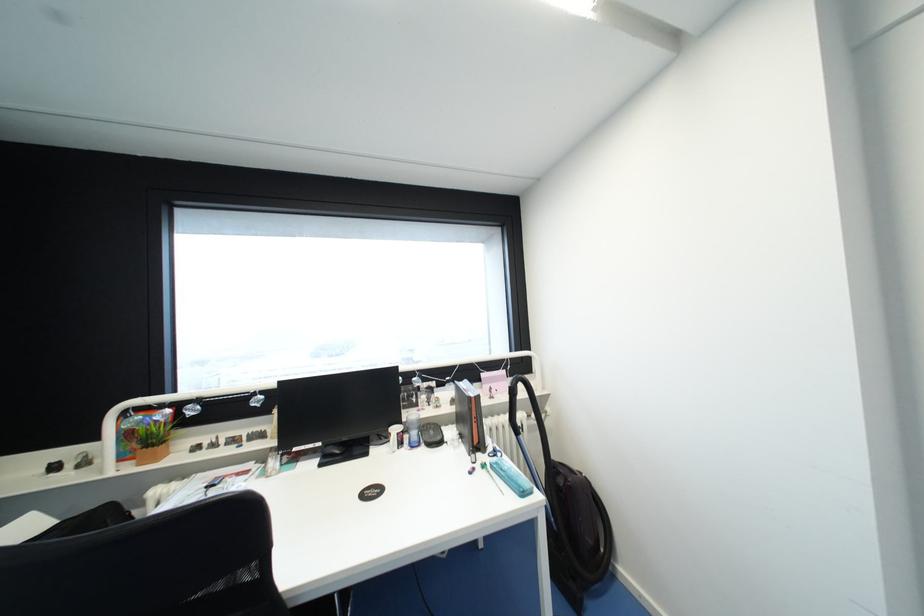
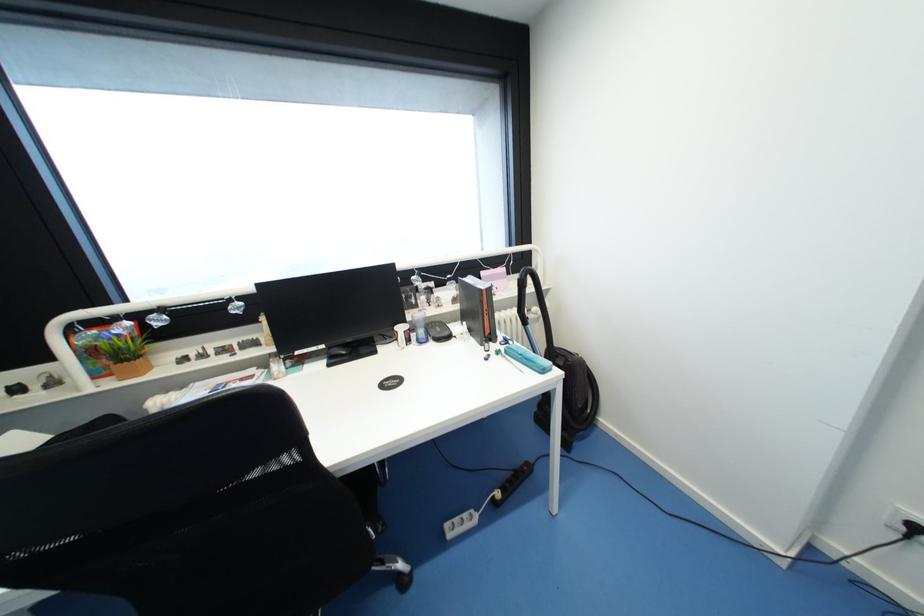
Question: Based on the continuous images, in which direction is the camera rotating? Reply with the corresponding letter.

Choices:
 (A) Left
 (B) Right
 (C) Up
 (D) Down

Answer: (D)